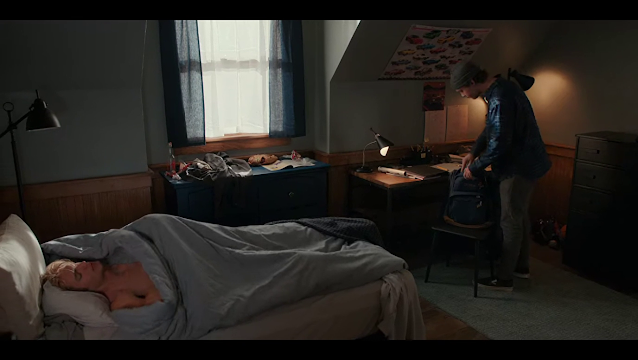
Locate an element on the screen. The height and width of the screenshot is (360, 638). window is located at coordinates (226, 66).